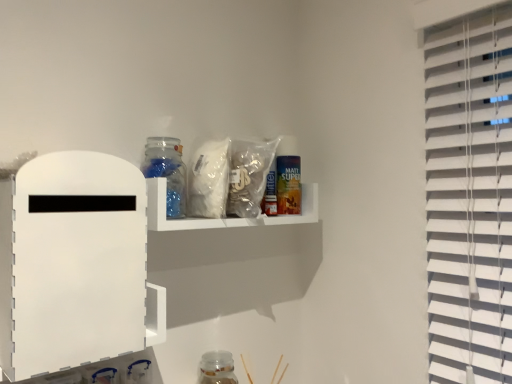
Question: Can you see transparent glass jar at upper center, acting as the 2th bottle starting from the back, touching white matte board at left, which is the 2th shelf in back-to-front order?

Choices:
 (A) no
 (B) yes

Answer: (A)

Question: Is white matte board at left, the second shelf in the right-to-left sequence, inside transparent glass jar at upper center, the 1th bottle from the left?

Choices:
 (A) no
 (B) yes

Answer: (A)

Question: Is transparent glass jar at upper center, marked as the first bottle in a top-to-bottom arrangement, outside of white matte board at left, which is the 2th shelf in back-to-front order?

Choices:
 (A) yes
 (B) no

Answer: (A)

Question: From the image's perspective, is transparent glass jar at upper center, the 1th bottle from the left, below white matte board at left, placed as the first shelf when sorted from front to back?

Choices:
 (A) yes
 (B) no

Answer: (B)

Question: Is transparent glass jar at upper center, which is the second bottle from bottom to top, to the right of white matte board at left, the second shelf in the right-to-left sequence, from the viewer's perspective?

Choices:
 (A) yes
 (B) no

Answer: (A)

Question: In the image, is translucent plastic bag at upper center positioned in front of or behind transparent glass jar at lower center, which is the 1th bottle in right-to-left order?

Choices:
 (A) front
 (B) behind

Answer: (A)

Question: Considering the relative positions of translucent plastic bag at upper center and transparent glass jar at lower center, which is the first bottle from back to front, in the image provided, is translucent plastic bag at upper center to the left or to the right of transparent glass jar at lower center, which is the first bottle from back to front,?

Choices:
 (A) left
 (B) right

Answer: (A)

Question: Is translucent plastic bag at upper center inside or outside of transparent glass jar at lower center, which is the 1th bottle from bottom to top?

Choices:
 (A) inside
 (B) outside

Answer: (B)

Question: Is point (192, 208) closer or farther from the camera than point (226, 382)?

Choices:
 (A) closer
 (B) farther

Answer: (A)

Question: From a real-world perspective, is translucent plastic bag at upper center physically located above or below translucent plastic shelf at upper center, the 1th shelf when ordered from back to front?

Choices:
 (A) below
 (B) above

Answer: (B)

Question: Considering the positions of point [x=201, y=155] and point [x=296, y=221], is point [x=201, y=155] closer or farther from the camera than point [x=296, y=221]?

Choices:
 (A) closer
 (B) farther

Answer: (A)

Question: Considering the positions of translucent plastic bag at upper center and translucent plastic shelf at upper center, marked as the 2th shelf in a left-to-right arrangement, in the image, is translucent plastic bag at upper center bigger or smaller than translucent plastic shelf at upper center, marked as the 2th shelf in a left-to-right arrangement,?

Choices:
 (A) big
 (B) small

Answer: (A)

Question: From the image's perspective, is translucent plastic bag at upper center positioned above or below translucent plastic shelf at upper center, which is the first shelf from right to left?

Choices:
 (A) above
 (B) below

Answer: (A)

Question: Based on their sizes in the image, would you say transparent glass jar at lower center, which is the first bottle from back to front, is bigger or smaller than translucent plastic shelf at upper center, the second shelf positioned from the front?

Choices:
 (A) small
 (B) big

Answer: (A)

Question: From a real-world perspective, is transparent glass jar at lower center, the second bottle viewed from the top, positioned above or below translucent plastic shelf at upper center, which is the first shelf from right to left?

Choices:
 (A) above
 (B) below

Answer: (B)